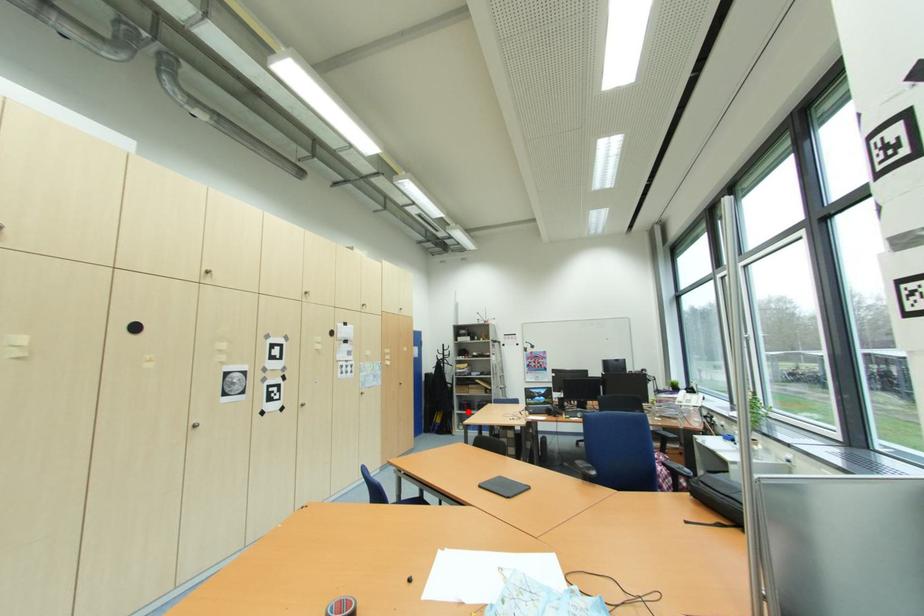
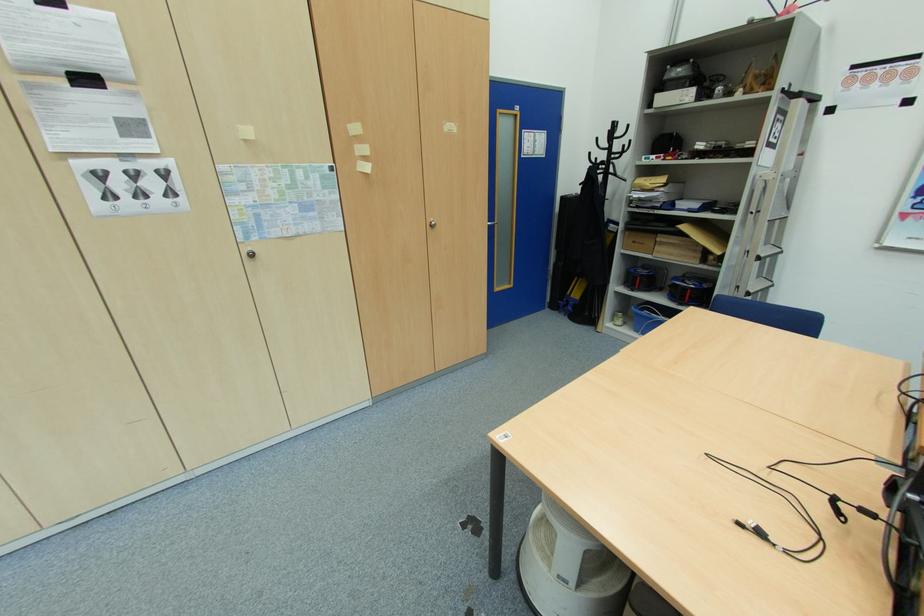
Question: I am providing you with two images of the same scene from different viewpoints. A red point is shown in image1. For the corresponding object point in image2, is it positioned nearer or farther from the camera?

Choices:
 (A) Nearer
 (B) Farther

Answer: (A)